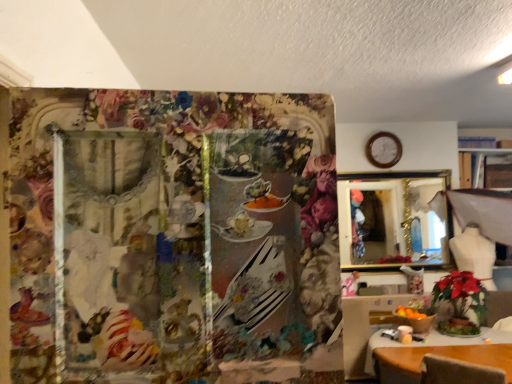
Question: Looking at their shapes, would you say gold-framed mirror at upper right is wider or thinner than wooden table at lower right, which appears as the second table when viewed from the right?

Choices:
 (A) wide
 (B) thin

Answer: (B)

Question: Relative to wooden table at lower right, which is counted as the 1th table, starting from the back, is gold-framed mirror at upper right in front or behind?

Choices:
 (A) behind
 (B) front

Answer: (A)

Question: Estimate the real-world distances between objects in this image. Which object is farther from the wooden table at lower right, placed as the 1th table when sorted from right to left?

Choices:
 (A) wooden clock at upper right
 (B) green leafy plant at lower right
 (C) gold-framed mirror at upper right
 (D) wooden table at lower right, which appears as the second table when viewed from the right

Answer: (A)

Question: Based on their relative distances, which object is nearer to the wooden clock at upper right?

Choices:
 (A) wooden table at lower right, which is the second table in front-to-back order
 (B) wooden table at lower right, arranged as the second table when viewed from the back
 (C) gold-framed mirror at upper right
 (D) green leafy plant at lower right

Answer: (C)